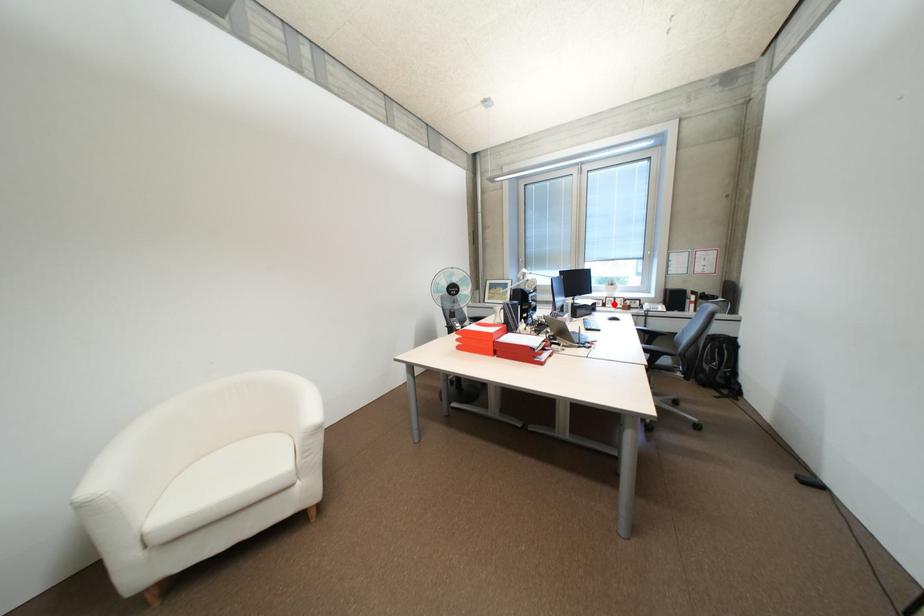
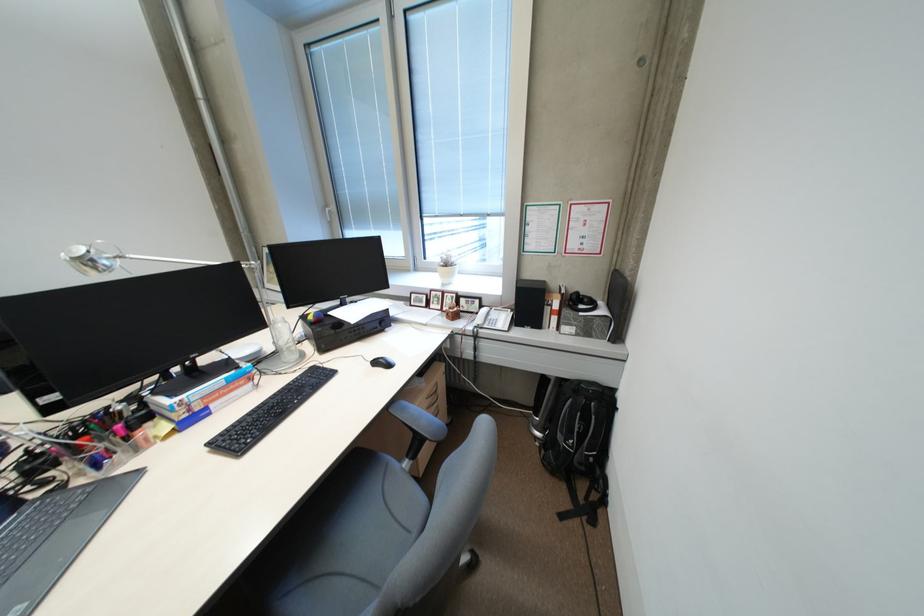
Question: I am providing you with two images of the same scene from different viewpoints. In image1, a red point is highlighted. Considering the same 3D point in image2, which of the following is correct?

Choices:
 (A) It is closer
 (B) It is farther

Answer: (A)